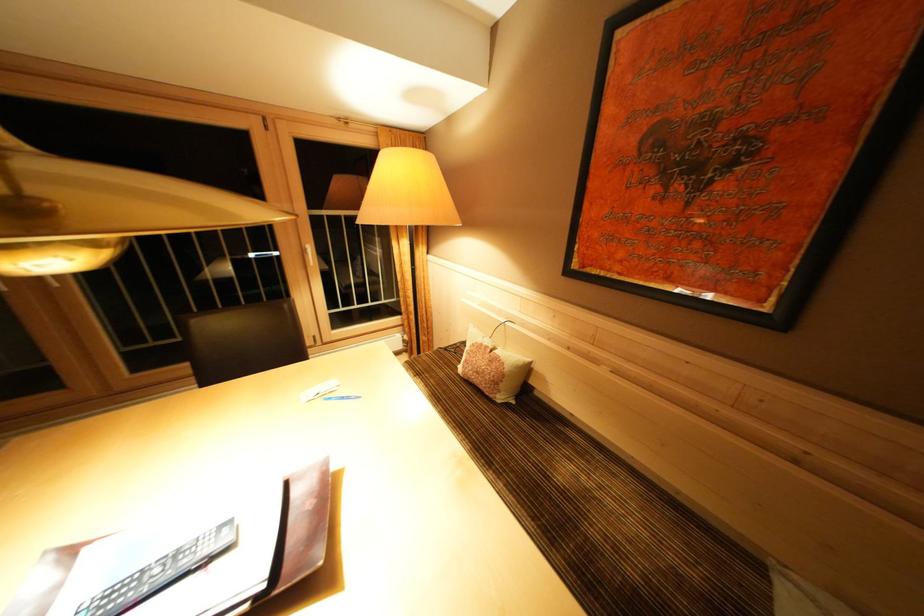
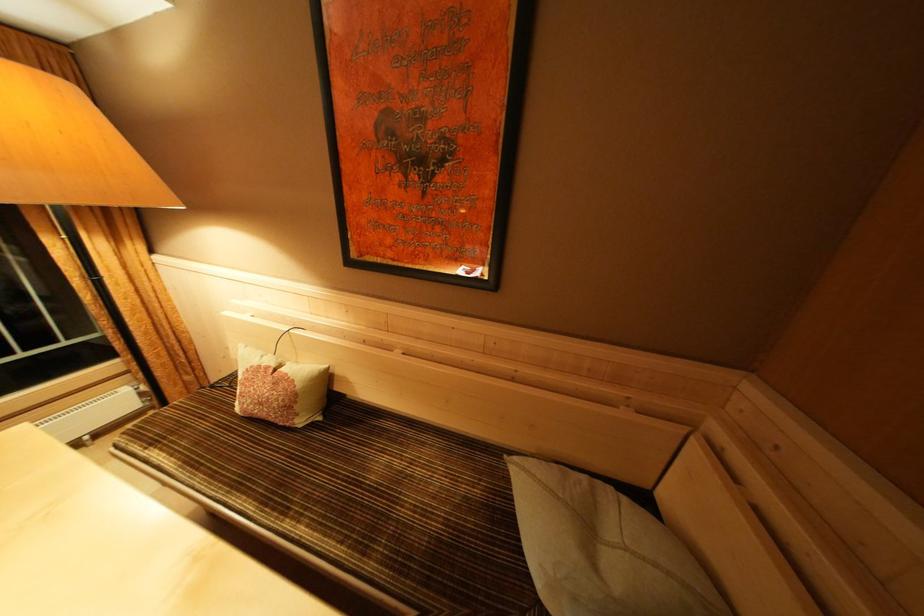
Question: The camera is either moving clockwise (left) or counter-clockwise (right) around the object. The first image is from the beginning of the video and the second image is from the end. Is the camera moving left or right when shooting the video?

Choices:
 (A) Left
 (B) Right

Answer: (A)